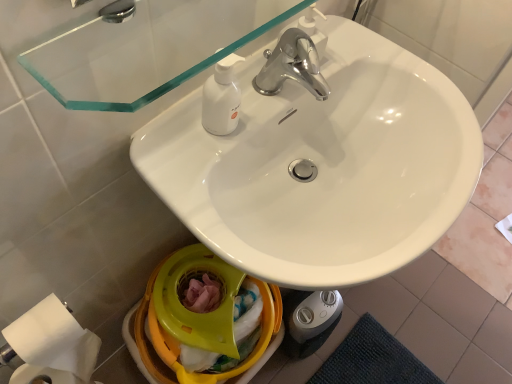
Question: Does yellow plastic bidet at lower center have a lesser width compared to transparent glass mirror at upper center?

Choices:
 (A) no
 (B) yes

Answer: (A)

Question: Does yellow plastic bidet at lower center appear on the right side of transparent glass mirror at upper center?

Choices:
 (A) yes
 (B) no

Answer: (B)

Question: Can we say yellow plastic bidet at lower center lies outside transparent glass mirror at upper center?

Choices:
 (A) yes
 (B) no

Answer: (A)

Question: Considering the relative sizes of yellow plastic bidet at lower center and transparent glass mirror at upper center in the image provided, is yellow plastic bidet at lower center wider than transparent glass mirror at upper center?

Choices:
 (A) no
 (B) yes

Answer: (B)

Question: Is yellow plastic bidet at lower center positioned in front of transparent glass mirror at upper center?

Choices:
 (A) yes
 (B) no

Answer: (B)

Question: In terms of height, does transparent glass mirror at upper center look taller or shorter compared to yellow plastic bidet at lower center?

Choices:
 (A) short
 (B) tall

Answer: (A)

Question: Do you think transparent glass mirror at upper center is within yellow plastic bidet at lower center, or outside of it?

Choices:
 (A) inside
 (B) outside

Answer: (B)

Question: From the image's perspective, is transparent glass mirror at upper center above or below yellow plastic bidet at lower center?

Choices:
 (A) below
 (B) above

Answer: (B)

Question: Considering the positions of point (173, 38) and point (200, 344), is point (173, 38) closer or farther from the camera than point (200, 344)?

Choices:
 (A) farther
 (B) closer

Answer: (B)

Question: Looking at their shapes, would you say white matte toilet paper at lower left is wider or thinner than yellow plastic bidet at lower center?

Choices:
 (A) wide
 (B) thin

Answer: (B)

Question: Considering the relative positions of white matte toilet paper at lower left and yellow plastic bidet at lower center in the image provided, is white matte toilet paper at lower left to the left or to the right of yellow plastic bidet at lower center?

Choices:
 (A) right
 (B) left

Answer: (B)

Question: Is point coord(37,372) positioned closer to the camera than point coord(141,322)?

Choices:
 (A) closer
 (B) farther

Answer: (A)

Question: Is white matte toilet paper at lower left in front of or behind yellow plastic bidet at lower center in the image?

Choices:
 (A) front
 (B) behind

Answer: (A)

Question: Considering the positions of white matte toilet paper at lower left and white glossy sink at center in the image, is white matte toilet paper at lower left wider or thinner than white glossy sink at center?

Choices:
 (A) thin
 (B) wide

Answer: (A)

Question: Based on their positions, is white matte toilet paper at lower left located to the left or right of white glossy sink at center?

Choices:
 (A) right
 (B) left

Answer: (B)